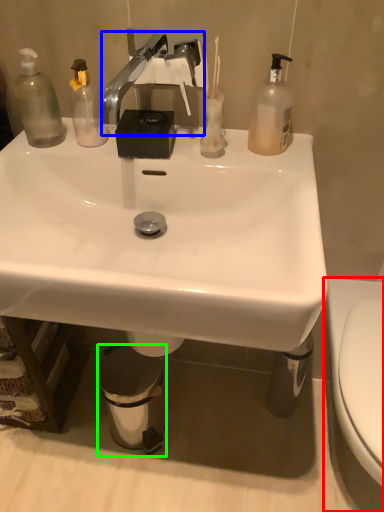
Question: Which is farther away from toilet (highlighted by a red box)? faucet (highlighted by a blue box) or trash bin/can (highlighted by a green box)?

Choices:
 (A) faucet
 (B) trash bin/can

Answer: (A)